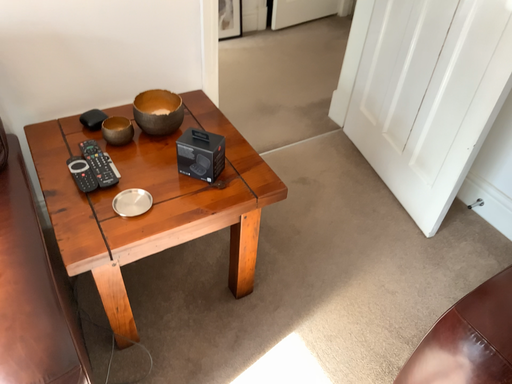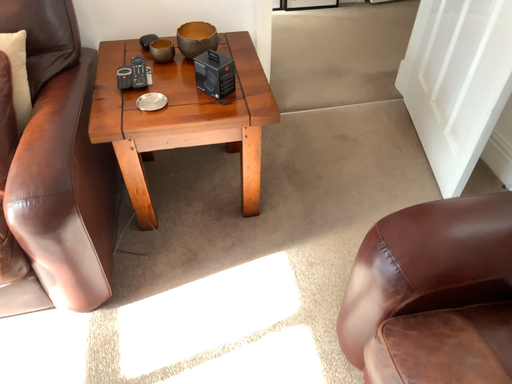
Question: Which way did the camera rotate in the video?

Choices:
 (A) rotated right
 (B) rotated left

Answer: (B)